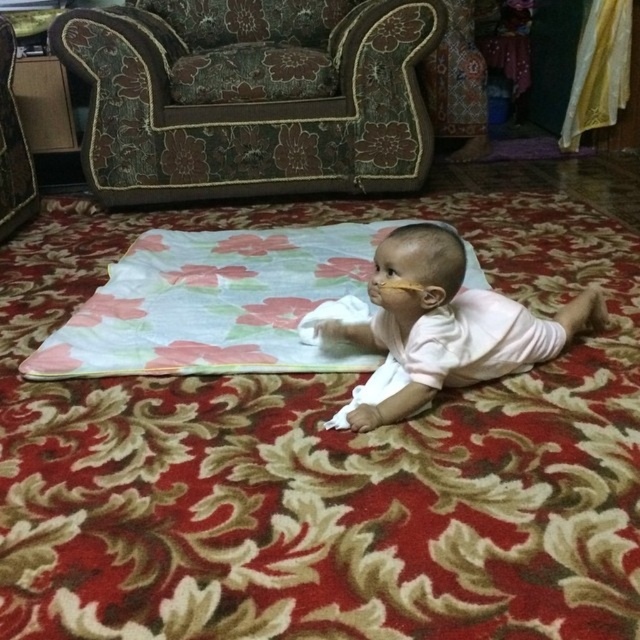
Can you confirm if floral fabric mat at center is taller than pink smooth baby at center?

Correct, floral fabric mat at center is much taller as pink smooth baby at center.

Can you confirm if floral fabric mat at center is shorter than pink smooth baby at center?

No, floral fabric mat at center is not shorter than pink smooth baby at center.

Is point (396, 202) closer to viewer compared to point (428, 266)?

That is False.

This screenshot has height=640, width=640. Find the location of `floral fabric mat at center`. floral fabric mat at center is located at coordinates (324, 461).

Is point (618, 284) positioned after point (348, 314)?

Yes, point (618, 284) is behind point (348, 314).

Who is positioned more to the left, floral fabric mat at center or white soft diaper at center?

white soft diaper at center

In order to click on floral fabric mat at center in this screenshot , I will do `click(324, 461)`.

Can you confirm if floral fabric armchair at upper left is wider than white soft diaper at center?

Indeed, floral fabric armchair at upper left has a greater width compared to white soft diaper at center.

What do you see at coordinates (252, 96) in the screenshot? Image resolution: width=640 pixels, height=640 pixels. I see `floral fabric armchair at upper left` at bounding box center [252, 96].

Locate an element on the screen. This screenshot has width=640, height=640. floral fabric armchair at upper left is located at coordinates 252,96.